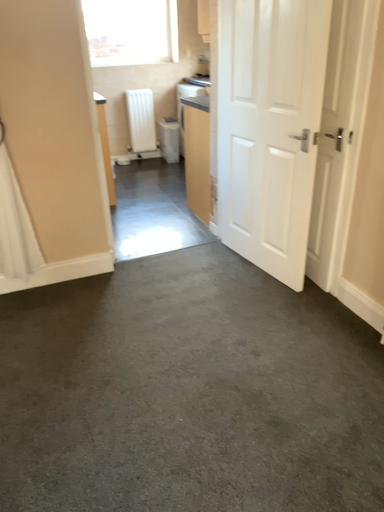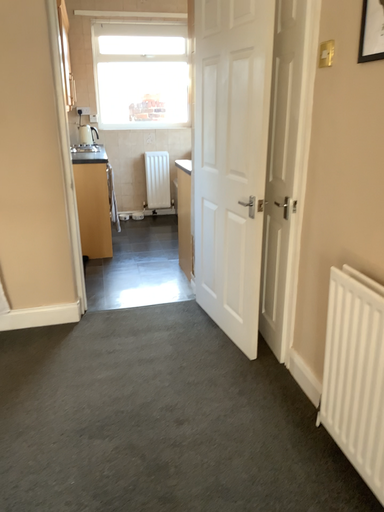
Question: How did the camera likely rotate when shooting the video?

Choices:
 (A) rotated left
 (B) rotated right

Answer: (A)